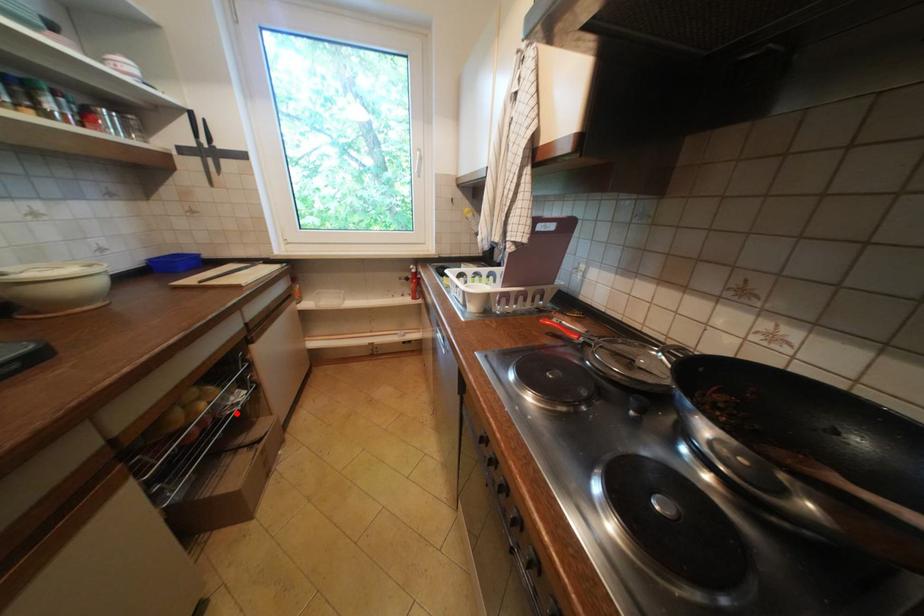
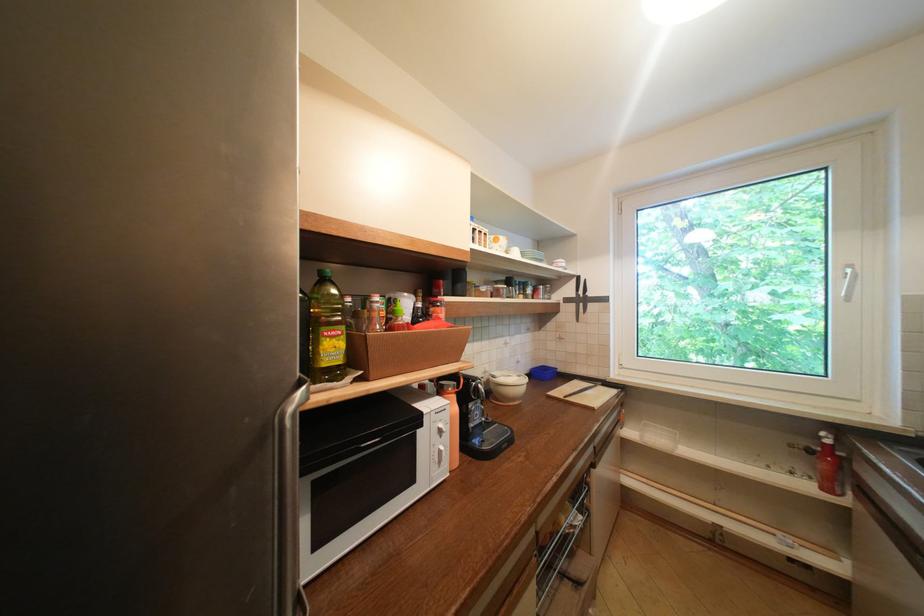
Question: I am providing you with two images of the same scene from different viewpoints. In image1, a red point is highlighted. Considering the same 3D point in image2, which of the following is correct?

Choices:
 (A) It is closer
 (B) It is farther

Answer: (B)